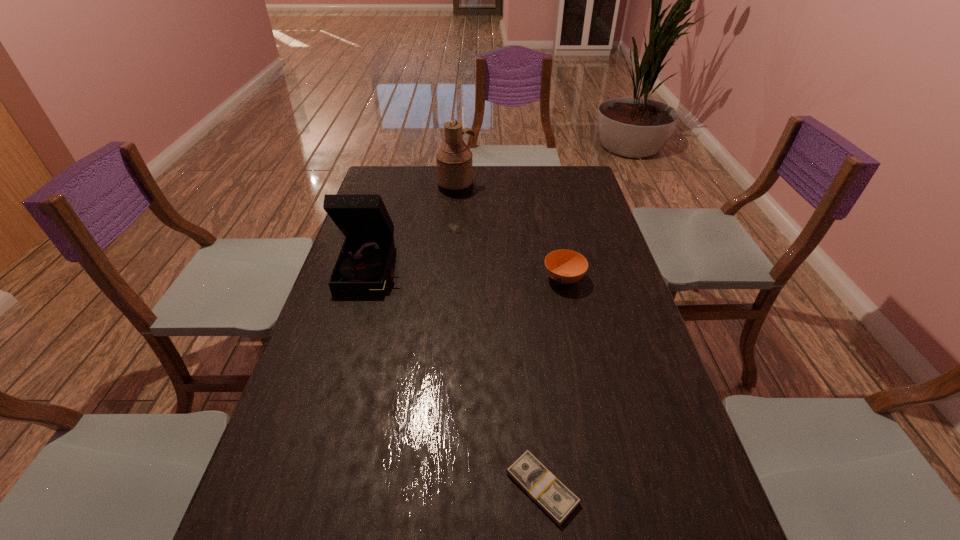
Identify the location of free space in the image that satisfies the following two spatial constraints: 1. on the front side of the second object from left to right; 2. on the right side of the nearest object. Image resolution: width=960 pixels, height=540 pixels. (432, 488).

Where is `vacant space that satisfies the following two spatial constraints: 1. on the front side of the nearest object; 2. on the left side of the pitcher`? Image resolution: width=960 pixels, height=540 pixels. vacant space that satisfies the following two spatial constraints: 1. on the front side of the nearest object; 2. on the left side of the pitcher is located at coordinates (432, 488).

The image size is (960, 540). Identify the location of vacant position in the image that satisfies the following two spatial constraints: 1. on the back side of the dollar; 2. on the right side of the soup bowl. [x=520, y=279].